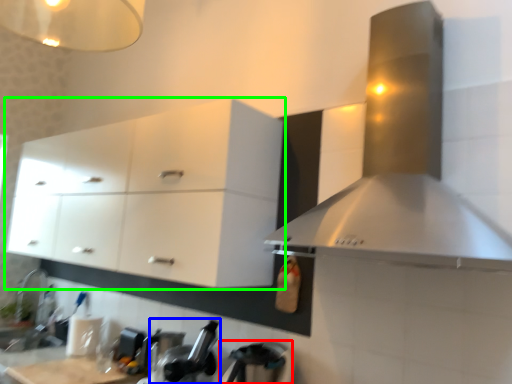
Question: Which is nearer to the appliance (highlighted by a red box)? appliance (highlighted by a blue box) or cabinetry (highlighted by a green box).

Choices:
 (A) appliance
 (B) cabinetry

Answer: (A)